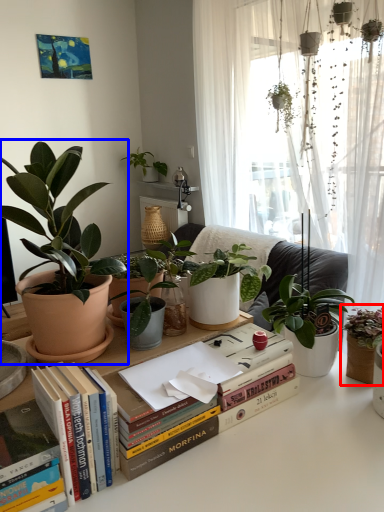
Question: Which object is further to the camera taking this photo, houseplant (highlighted by a red box) or houseplant (highlighted by a blue box)?

Choices:
 (A) houseplant
 (B) houseplant

Answer: (A)